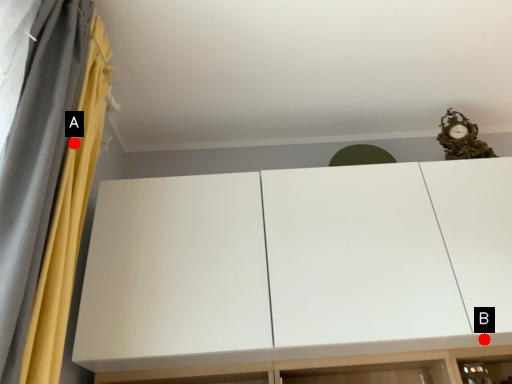
Question: Two points are circled on the image, labeled by A and B beside each circle. Which point is closer to the camera?

Choices:
 (A) A is closer
 (B) B is closer

Answer: (A)